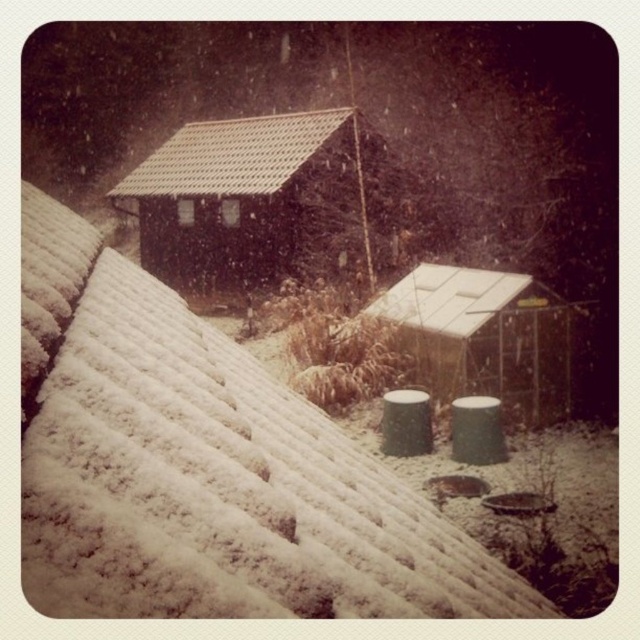
You are standing in the snowy scene and want to locate the white plastic shed at center. According to the scene description, where should you look relative to the brown tile roof at upper center?

The white plastic shed at center is positioned on the right side of brown tile roof at upper center, so you should look to the right side of the brown tile roof at upper center to find it.

Consider the image. You are standing in the snowy scene and want to place a new snowman kit in a spot that is sheltered from the wind. Which object should you place it under to ensure it stays protected? The white plastic shed at center or the brown tile roof at upper center?

The white plastic shed at center is positioned under the brown tile roof at upper center, so placing the snowman kit under the brown tile roof at upper center would provide better shelter from the wind.

You are standing at the base of a snowy hill and see the brown wooden hut at upper center and the brown tile roof at upper center. Which one is positioned to the right side?

The brown wooden hut at upper center is positioned to the right of the brown tile roof at upper center.